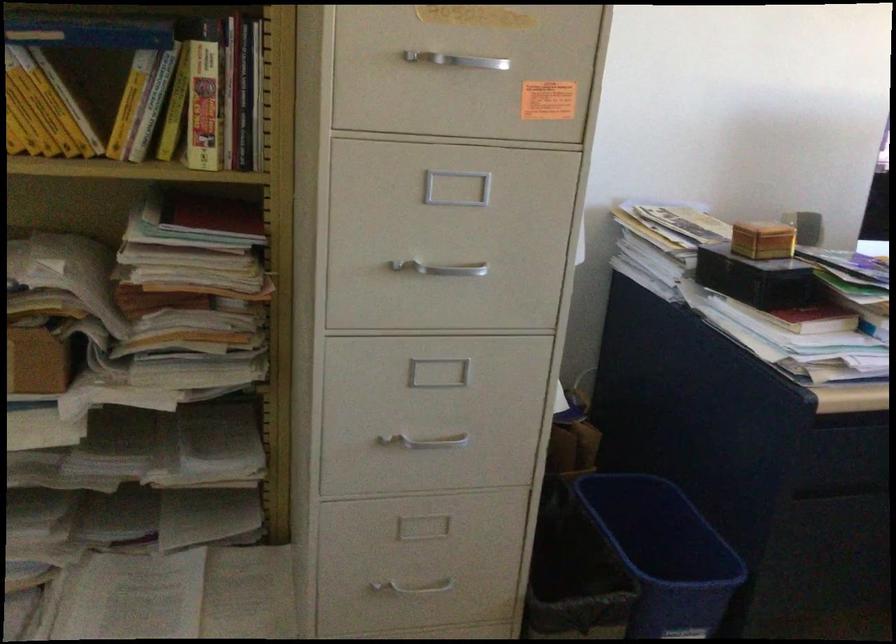
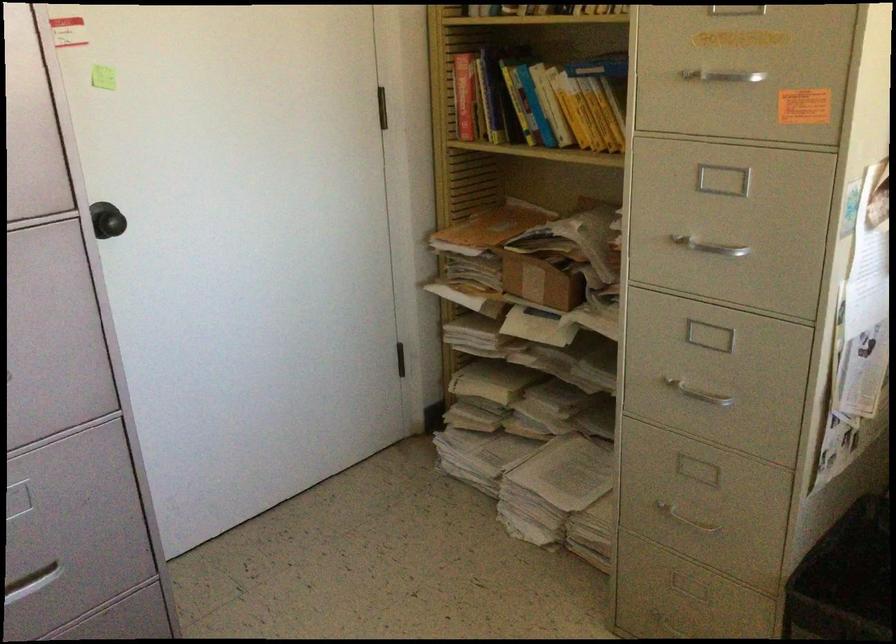
Where in the second image is the point corresponding to point (434, 431) from the first image?

(699, 391)